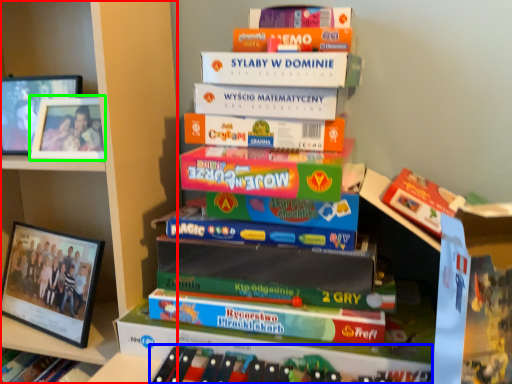
Question: Which object is the farthest from bookcase (highlighted by a red box)? Choose among these: book (highlighted by a blue box) or picture frame (highlighted by a green box).

Choices:
 (A) book
 (B) picture frame

Answer: (A)